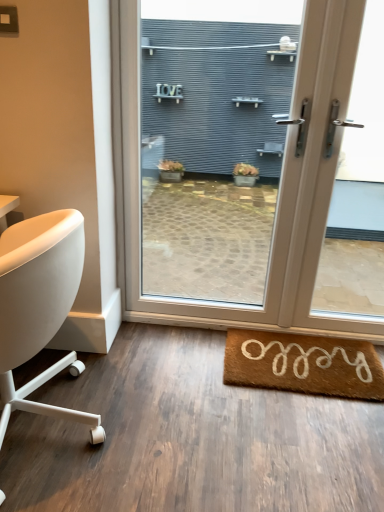
This screenshot has height=512, width=384. In order to click on vacant space to the right of white leather chair at left in this screenshot , I will do `click(173, 430)`.